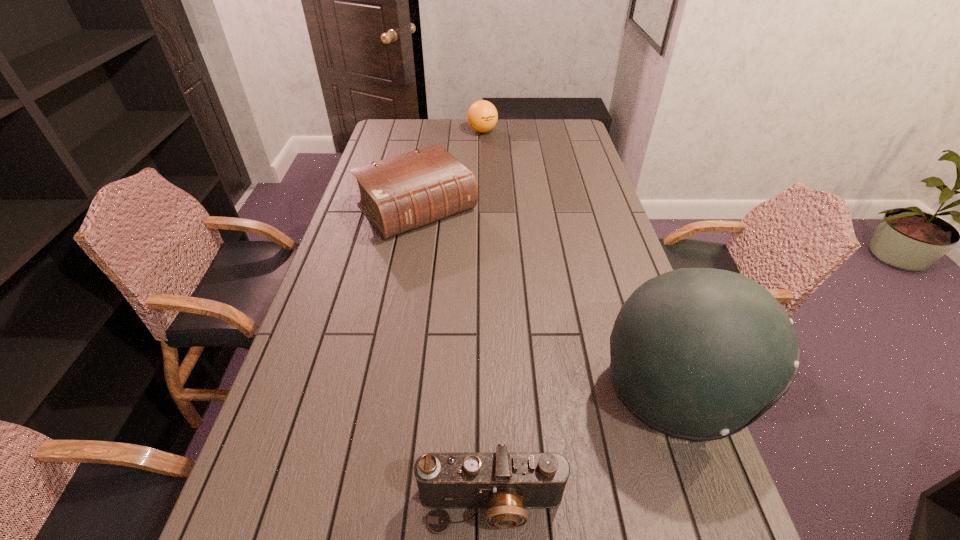
Identify the location of free spot between the Bible and the camera. This screenshot has height=540, width=960. (454, 356).

Where is `empty space between the camera and the farthest object`? This screenshot has height=540, width=960. empty space between the camera and the farthest object is located at coordinates (487, 318).

At what (x,y) coordinates should I click in order to perform the action: click on free space between the farthest object and the nearest object. Please return your answer as a coordinate pair (x, y). This screenshot has height=540, width=960. Looking at the image, I should click on (487, 318).

The image size is (960, 540). Find the location of `blank region between the tallest object and the camera`. blank region between the tallest object and the camera is located at coordinates (583, 448).

Image resolution: width=960 pixels, height=540 pixels. I want to click on free space between the football helmet and the third nearest object, so click(x=545, y=300).

The width and height of the screenshot is (960, 540). In order to click on vacant area between the second farthest object and the nearest object in this screenshot , I will do (454, 356).

Image resolution: width=960 pixels, height=540 pixels. I want to click on free space between the camera and the ping-pong ball, so click(487, 318).

Where is `free point between the second nearest object and the second farthest object`? This screenshot has width=960, height=540. free point between the second nearest object and the second farthest object is located at coordinates (545, 300).

This screenshot has height=540, width=960. What are the coordinates of `object that stands as the third closest to the nearest object` in the screenshot? It's located at (482, 116).

Select which object is the third closest to the camera. Please provide its 2D coordinates. Your answer should be formatted as a tuple, i.e. [(x, y)], where the tuple contains the x and y coordinates of a point satisfying the conditions above.

[(482, 116)]